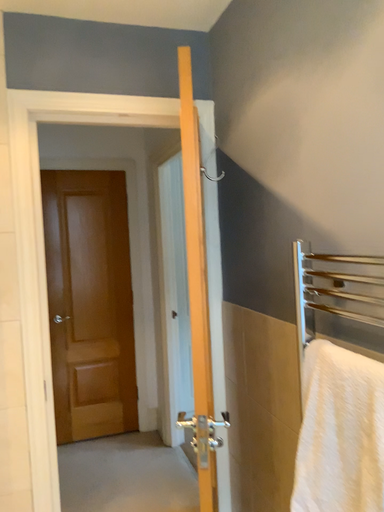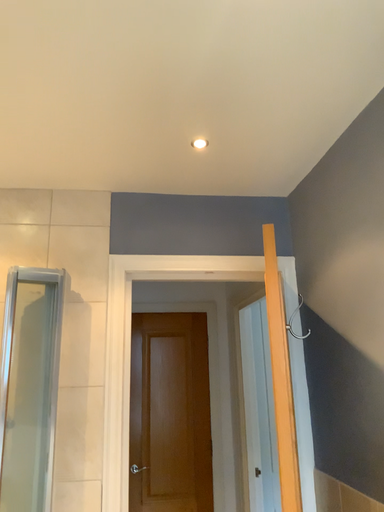
Question: How did the camera likely rotate when shooting the video?

Choices:
 (A) rotated right
 (B) rotated left

Answer: (B)